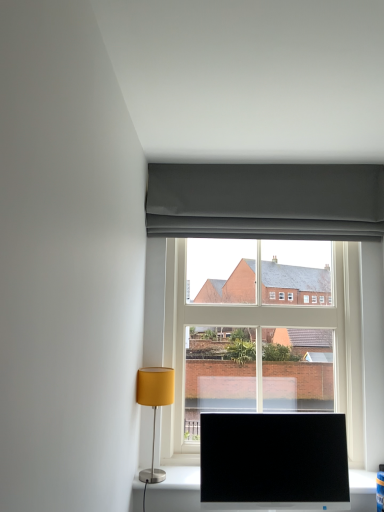
You are a GUI agent. You are given a task and a screenshot of the screen. Output one action in this format:
    pyautogui.click(x=<x>, y=<y>)
    Task: Click on the black glossy monitor at lower center
    Image resolution: width=384 pixels, height=512 pixels.
    Given the screenshot: What is the action you would take?
    pyautogui.click(x=273, y=458)

Find the location of a particular element. This screenshot has width=384, height=512. matte yellow fabric lampshade at lower left is located at coordinates (154, 406).

Is matte yellow fabric lampshade at lower left beside matte gray curtain at upper center?

No, matte yellow fabric lampshade at lower left is not touching matte gray curtain at upper center.

From a real-world perspective, which is physically above, matte yellow fabric lampshade at lower left or matte gray curtain at upper center?

In real-world perspective, matte gray curtain at upper center is above.

In terms of height, does matte yellow fabric lampshade at lower left look taller or shorter compared to matte gray curtain at upper center?

matte yellow fabric lampshade at lower left is taller than matte gray curtain at upper center.

Locate an element on the screen. The image size is (384, 512). curtain above the matte yellow fabric lampshade at lower left (from a real-world perspective) is located at coordinates (266, 201).

Can we say clear glass window at center lies outside matte gray curtain at upper center?

clear glass window at center is positioned outside matte gray curtain at upper center.

Between clear glass window at center and matte gray curtain at upper center, which one has more height?

Standing taller between the two is clear glass window at center.

In the scene shown: Is clear glass window at center far from matte gray curtain at upper center?

No.

Can you confirm if clear glass window at center is bigger than matte gray curtain at upper center?

Yes.

From a real-world perspective, between black glossy monitor at lower center and clear glass window at center, who is vertically lower?

In real-world perspective, black glossy monitor at lower center is lower.

Is black glossy monitor at lower center positioned far away from clear glass window at center?

black glossy monitor at lower center is near clear glass window at center, not far away.

Considering the relative positions of black glossy monitor at lower center and clear glass window at center in the image provided, is black glossy monitor at lower center in front of clear glass window at center?

Yes, black glossy monitor at lower center is closer to the camera.

Is clear glass window at center located within black glossy monitor at lower center?

No, black glossy monitor at lower center does not contain clear glass window at center.

How distant is matte gray curtain at upper center from black glossy monitor at lower center?

matte gray curtain at upper center and black glossy monitor at lower center are 35.51 inches apart.

Which object is further away from the camera, matte gray curtain at upper center or black glossy monitor at lower center?

Positioned behind is matte gray curtain at upper center.

Between point (164, 175) and point (264, 480), which one is positioned in front?

The point (264, 480) is more forward.

Considering the relative sizes of matte gray curtain at upper center and black glossy monitor at lower center in the image provided, is matte gray curtain at upper center taller than black glossy monitor at lower center?

No, matte gray curtain at upper center is not taller than black glossy monitor at lower center.

Find the location of `table lamp lying above the black glossy monitor at lower center (from the image's perspective)`. table lamp lying above the black glossy monitor at lower center (from the image's perspective) is located at coordinates (154, 406).

Does matte yellow fabric lampshade at lower left lie in front of black glossy monitor at lower center?

No, matte yellow fabric lampshade at lower left is further to the viewer.

How different are the orientations of matte yellow fabric lampshade at lower left and black glossy monitor at lower center in degrees?

0.238 degrees separate the facing orientations of matte yellow fabric lampshade at lower left and black glossy monitor at lower center.

Can you confirm if matte yellow fabric lampshade at lower left is bigger than black glossy monitor at lower center?

No.

Does point (275, 444) come behind point (255, 186)?

No, it is in front of (255, 186).

Is black glossy monitor at lower center oriented away from matte gray curtain at upper center?

No, black glossy monitor at lower center's orientation is not away from matte gray curtain at upper center.

Considering the sizes of objects black glossy monitor at lower center and matte gray curtain at upper center in the image provided, who is bigger, black glossy monitor at lower center or matte gray curtain at upper center?

matte gray curtain at upper center.

How distant is black glossy monitor at lower center from matte gray curtain at upper center?

The distance of black glossy monitor at lower center from matte gray curtain at upper center is 35.51 inches.

Would you consider matte gray curtain at upper center to be distant from matte yellow fabric lampshade at lower left?

No, matte gray curtain at upper center is not far from matte yellow fabric lampshade at lower left.

Measure the distance between matte gray curtain at upper center and matte yellow fabric lampshade at lower left.

matte gray curtain at upper center and matte yellow fabric lampshade at lower left are 33.75 inches apart from each other.

Would you say matte yellow fabric lampshade at lower left is part of matte gray curtain at upper center's contents?

No, matte yellow fabric lampshade at lower left is not a part of matte gray curtain at upper center.

Where is `table lamp in front of the matte gray curtain at upper center`? This screenshot has height=512, width=384. table lamp in front of the matte gray curtain at upper center is located at coordinates (154, 406).

This screenshot has height=512, width=384. I want to click on window lying below the matte gray curtain at upper center (from the image's perspective), so click(271, 268).

When comparing their distances from black glossy monitor at lower center, does matte yellow fabric lampshade at lower left or clear glass window at center seem closer?

Among the two, matte yellow fabric lampshade at lower left is located nearer to black glossy monitor at lower center.

Which object lies nearer to the anchor point clear glass window at center, matte gray curtain at upper center or black glossy monitor at lower center?

The object closer to clear glass window at center is matte gray curtain at upper center.

When comparing their distances from clear glass window at center, does matte yellow fabric lampshade at lower left or matte gray curtain at upper center seem closer?

Based on the image, matte gray curtain at upper center appears to be nearer to clear glass window at center.

From the picture: Estimate the real-world distances between objects in this image. Which object is closer to matte gray curtain at upper center, matte yellow fabric lampshade at lower left or black glossy monitor at lower center?

matte yellow fabric lampshade at lower left lies closer to matte gray curtain at upper center than the other object.

When comparing their distances from clear glass window at center, does matte gray curtain at upper center or matte yellow fabric lampshade at lower left seem further?

Based on the image, matte yellow fabric lampshade at lower left appears to be further to clear glass window at center.

Consider the image. Considering their positions, is black glossy monitor at lower center positioned further to matte yellow fabric lampshade at lower left than clear glass window at center?

Among the two, clear glass window at center is located further to matte yellow fabric lampshade at lower left.

Estimate the real-world distances between objects in this image. Which object is closer to clear glass window at center, black glossy monitor at lower center or matte yellow fabric lampshade at lower left?

The object closer to clear glass window at center is black glossy monitor at lower center.

Looking at the image, which one is located further to matte gray curtain at upper center, clear glass window at center or black glossy monitor at lower center?

Based on the image, black glossy monitor at lower center appears to be further to matte gray curtain at upper center.

The width and height of the screenshot is (384, 512). Identify the location of table lamp between matte gray curtain at upper center and black glossy monitor at lower center from top to bottom. (154, 406).

This screenshot has width=384, height=512. I want to click on television between matte yellow fabric lampshade at lower left and clear glass window at center, so click(x=273, y=458).

Where is `window between matte gray curtain at upper center and matte yellow fabric lampshade at lower left in the up-down direction`? window between matte gray curtain at upper center and matte yellow fabric lampshade at lower left in the up-down direction is located at coordinates (271, 268).

In order to click on window that lies between matte gray curtain at upper center and black glossy monitor at lower center from top to bottom in this screenshot , I will do `click(271, 268)`.